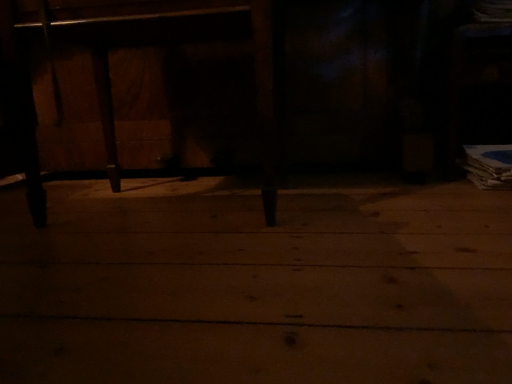
Image resolution: width=512 pixels, height=384 pixels. I want to click on vacant space in wooden table at center (from a real-world perspective), so click(238, 182).